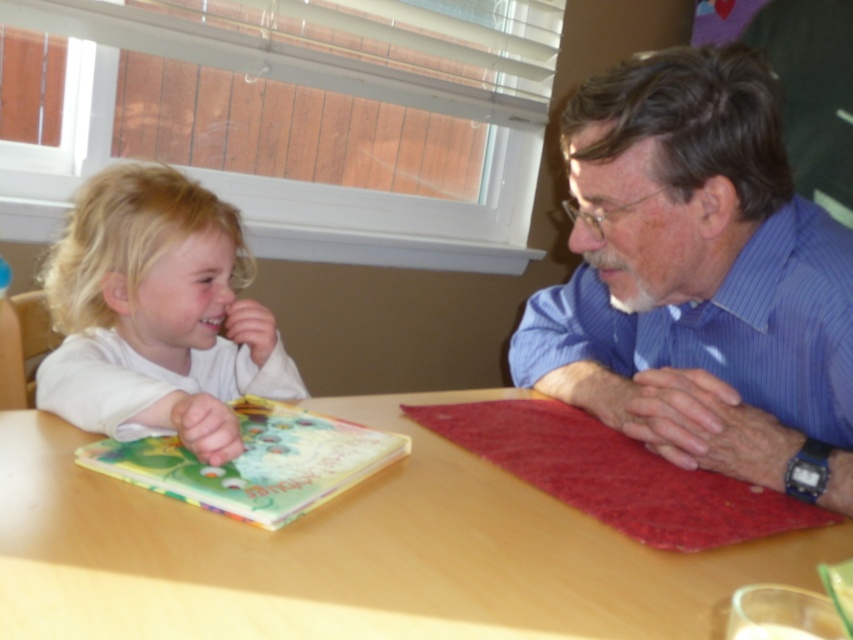
You are a photographer taking a picture of the blue striped shirt at upper right and the hardcover book at center. Which object should you focus on first to ensure both are in sharp focus?

You should focus on the hardcover book at center first because it is closer to the camera than the blue striped shirt at upper right, ensuring both will be in focus when using depth of field properly.

You are a photographer taking a portrait of the blue striped shirt at upper right and the white matte hair at left. Since you want to ensure both subjects are in focus, which one should you focus on first to maximize the depth of field?

The blue striped shirt at upper right is much taller than the white matte hair at left, so you should focus on the blue striped shirt at upper right first to ensure both are in focus.